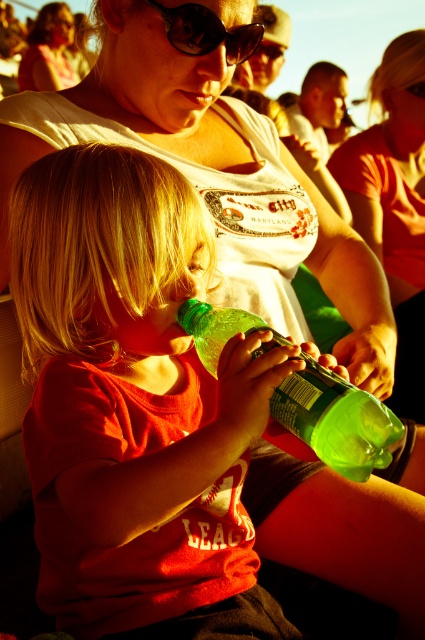
Does green translucent bottle at center come in front of matte black tank top at upper center?

Yes, it is.

Between green translucent bottle at center and matte black tank top at upper center, which one has more height?

matte black tank top at upper center is taller.

Between point (320, 419) and point (54, 81), which one is positioned in front?

Positioned in front is point (320, 419).

Locate an element on the screen. This screenshot has width=425, height=640. green translucent bottle at center is located at coordinates (337, 420).

Does matte white t-shirt at center have a lesser height compared to matte black tank top at upper center?

In fact, matte white t-shirt at center may be taller than matte black tank top at upper center.

Who is positioned more to the right, matte white t-shirt at center or matte black tank top at upper center?

matte white t-shirt at center

Is point (402, 70) positioned behind point (34, 64)?

That is False.

The width and height of the screenshot is (425, 640). Find the location of `matte white t-shirt at center`. matte white t-shirt at center is located at coordinates (394, 204).

Does matte white t-shirt at center appear under black plastic sunglasses at upper center?

Indeed, matte white t-shirt at center is positioned under black plastic sunglasses at upper center.

Does matte white t-shirt at center appear over black plastic sunglasses at upper center?

No, matte white t-shirt at center is not above black plastic sunglasses at upper center.

The width and height of the screenshot is (425, 640). I want to click on matte white t-shirt at center, so click(x=394, y=204).